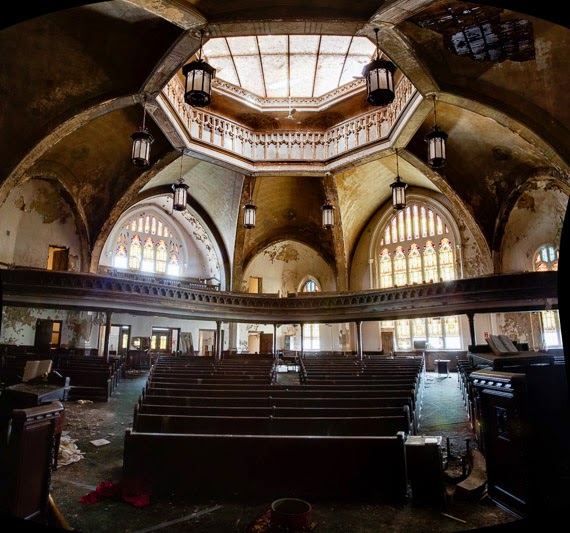
Identify the location of floor. (423, 403).